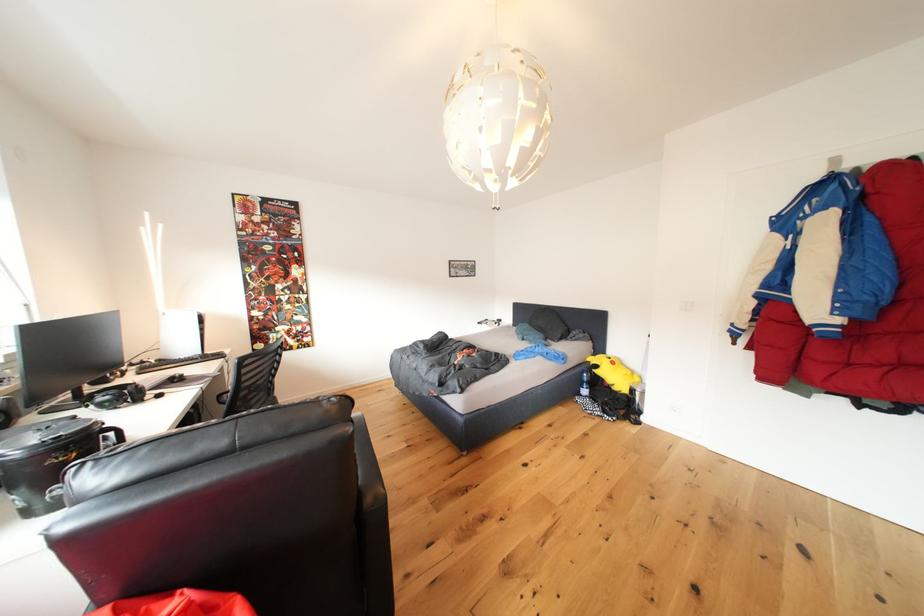
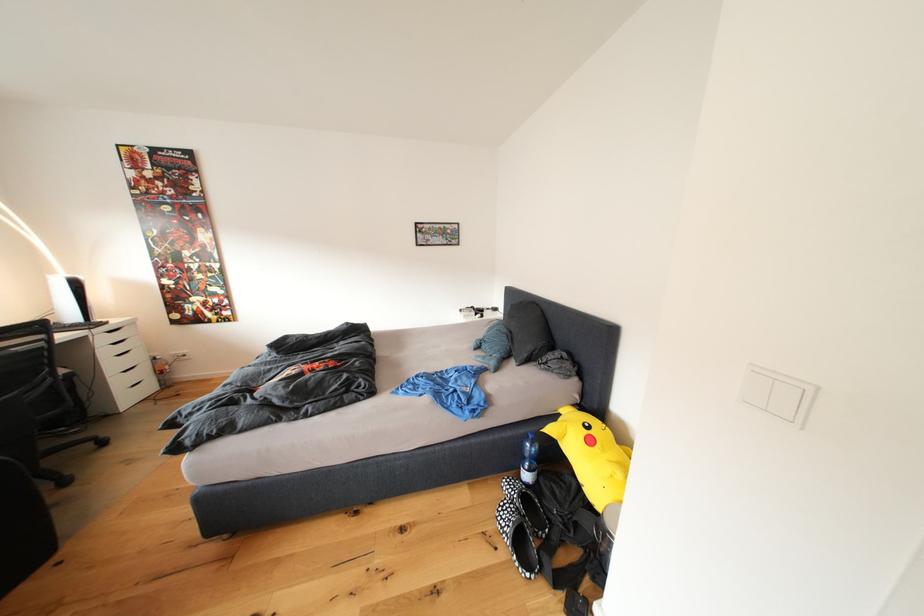
Find the pixel in the second image that matches (x=488, y=328) in the first image.

(469, 315)